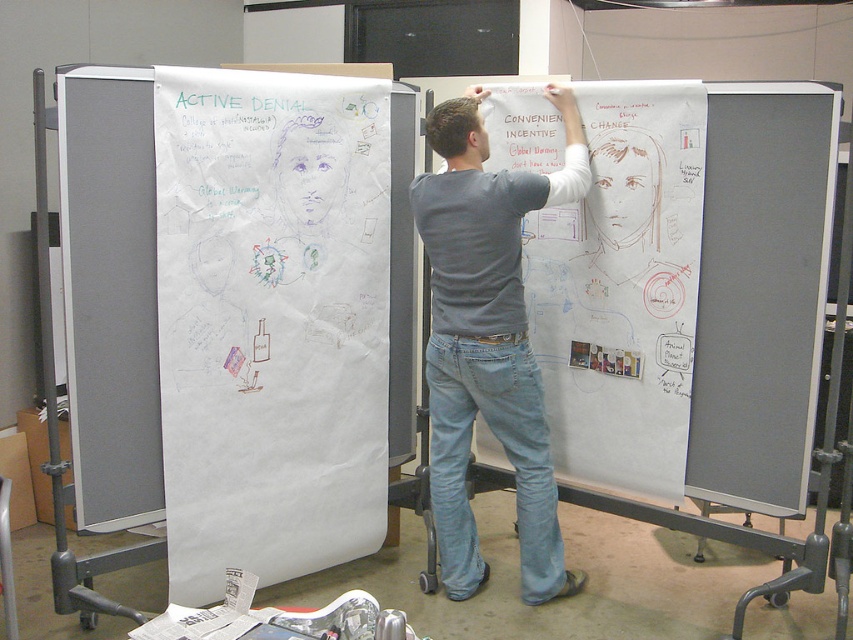
Question: Is white paperboard at center to the right of gray cotton shirt at center from the viewer's perspective?

Choices:
 (A) no
 (B) yes

Answer: (B)

Question: Which of the following is the closest to the observer?

Choices:
 (A) (433, 378)
 (B) (608, 435)

Answer: (A)

Question: Which object is farther from the camera taking this photo?

Choices:
 (A) white paperboard at center
 (B) gray cotton shirt at center
 (C) white paper at left

Answer: (A)

Question: Does white paperboard at center come behind gray cotton shirt at center?

Choices:
 (A) yes
 (B) no

Answer: (A)

Question: Does white paperboard at center lie in front of gray cotton shirt at center?

Choices:
 (A) no
 (B) yes

Answer: (A)

Question: Among these objects, which one is nearest to the camera?

Choices:
 (A) white paper at left
 (B) white paperboard at center
 (C) gray cotton shirt at center

Answer: (A)